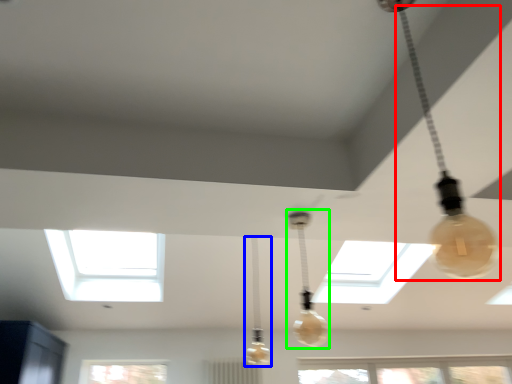
Question: Considering the real-world distances, which object is farthest from lamp (highlighted by a red box)? lamp (highlighted by a blue box) or lamp (highlighted by a green box)?

Choices:
 (A) lamp
 (B) lamp

Answer: (A)